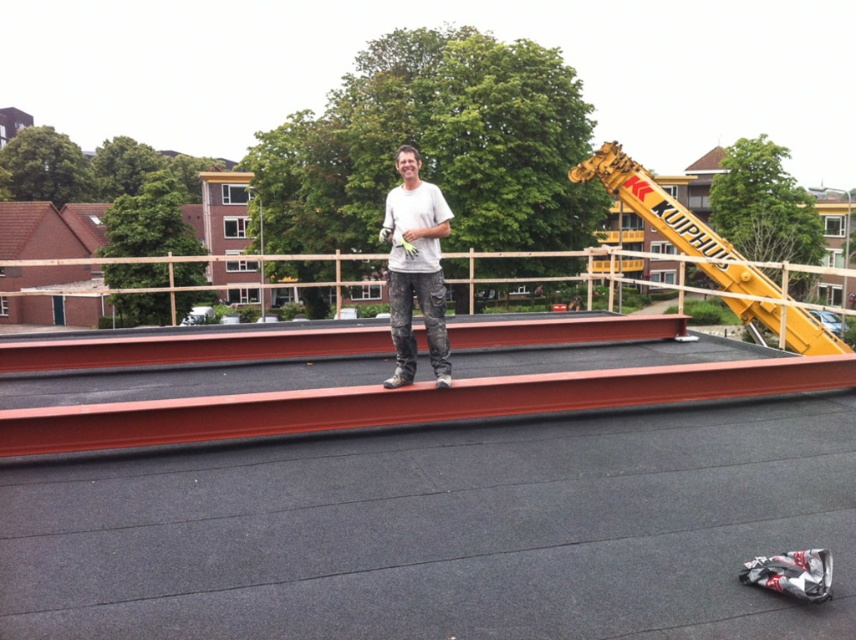
Question: Can you confirm if red steel beams at center is positioned below white matte shirt at center?

Choices:
 (A) yes
 (B) no

Answer: (A)

Question: Among these objects, which one is farthest from the camera?

Choices:
 (A) white matte shirt at center
 (B) red steel beams at center

Answer: (A)

Question: Is red steel beams at center positioned behind white matte shirt at center?

Choices:
 (A) no
 (B) yes

Answer: (A)

Question: Which point is farther from the camera taking this photo?

Choices:
 (A) (822, 381)
 (B) (423, 212)

Answer: (A)

Question: Which point appears closest to the camera in this image?

Choices:
 (A) (90, 410)
 (B) (409, 157)

Answer: (A)

Question: Is red steel beams at center smaller than white matte shirt at center?

Choices:
 (A) no
 (B) yes

Answer: (B)